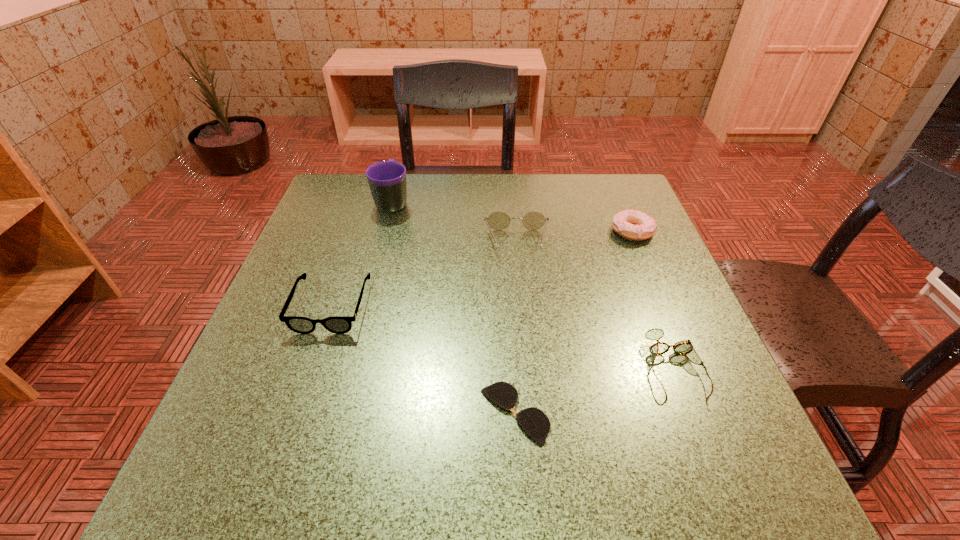
Locate an element on the screen. Image resolution: width=960 pixels, height=540 pixels. object located at the far left corner is located at coordinates (387, 179).

The height and width of the screenshot is (540, 960). Identify the location of object situated at the far right corner. (632, 224).

This screenshot has height=540, width=960. What are the coordinates of `vacant space at the far edge` in the screenshot? It's located at (473, 195).

This screenshot has height=540, width=960. In order to click on free spot at the near edge of the desktop in this screenshot , I will do `click(346, 499)`.

Identify the location of free region at the left edge of the desktop. The image size is (960, 540). (298, 287).

Image resolution: width=960 pixels, height=540 pixels. In the image, there is a desktop. Find the location of `vacant region at the right edge`. vacant region at the right edge is located at coordinates (655, 325).

In order to click on free space at the far left corner of the desktop in this screenshot , I will do `click(371, 209)`.

The width and height of the screenshot is (960, 540). Find the location of `free space at the far right corner of the desktop`. free space at the far right corner of the desktop is located at coordinates (633, 200).

This screenshot has height=540, width=960. I want to click on vacant space in between the farthest spectacles and the shortest object, so click(x=516, y=328).

Identify the location of free space between the third tallest spectacles and the farthest spectacles. The width and height of the screenshot is (960, 540). (595, 305).